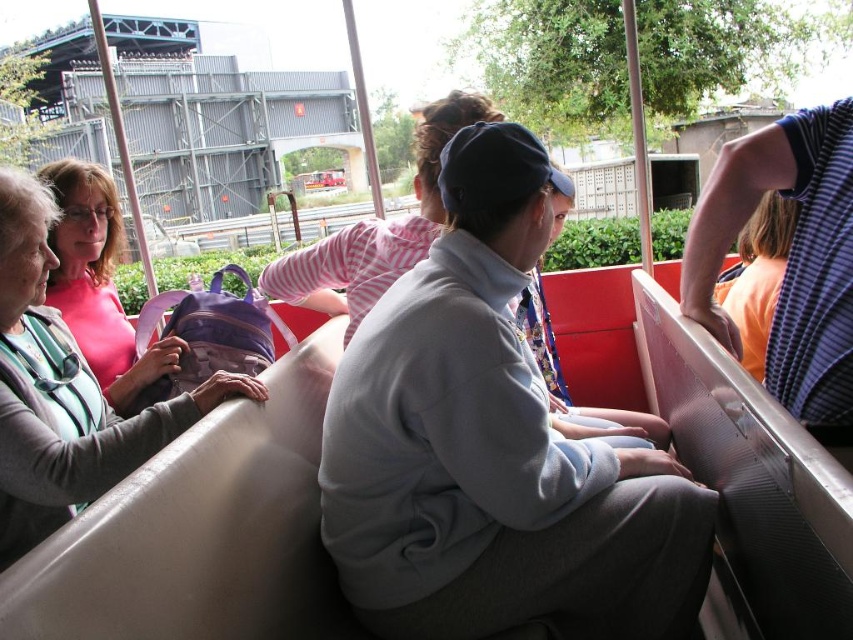
Question: Which point is closer to the camera?

Choices:
 (A) pos(350,474)
 (B) pos(173,403)
 (C) pos(753,156)

Answer: (A)

Question: Is matte pink shirt at left further to the viewer compared to striped cotton shirt at right?

Choices:
 (A) no
 (B) yes

Answer: (A)

Question: Based on their relative distances, which object is nearer to the striped cotton shirt at right?

Choices:
 (A) matte pink shirt at left
 (B) light gray fleece jacket at center

Answer: (B)

Question: Is light gray fleece jacket at center smaller than striped cotton shirt at right?

Choices:
 (A) no
 (B) yes

Answer: (A)

Question: Among these objects, which one is nearest to the camera?

Choices:
 (A) striped cotton shirt at right
 (B) light gray fleece jacket at center
 (C) matte pink shirt at left

Answer: (C)

Question: Does light gray fleece jacket at center lie behind matte pink shirt at left?

Choices:
 (A) no
 (B) yes

Answer: (B)